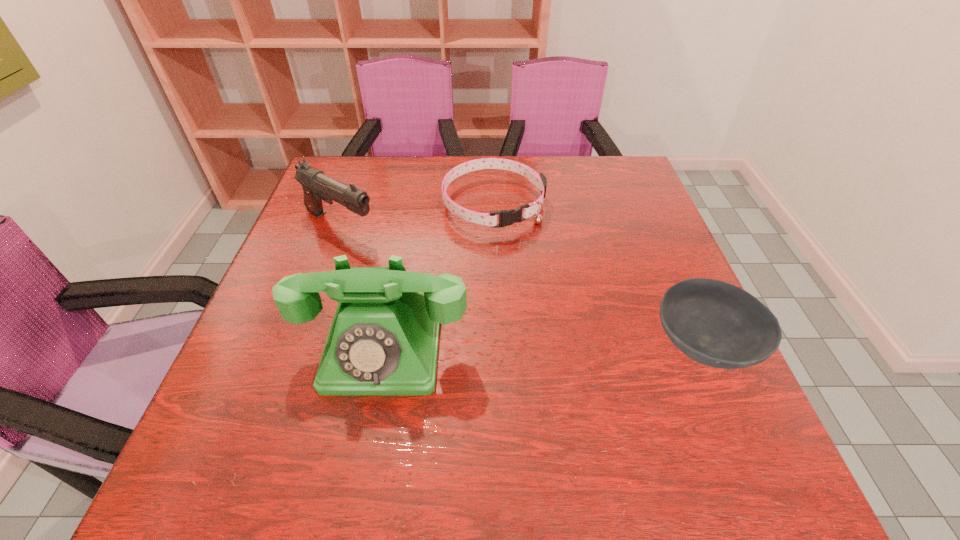
Locate an element on the screen. This screenshot has height=540, width=960. vacant space located in the direction the third shortest object is aimed is located at coordinates (474, 291).

Where is `free space located in the direction the third shortest object is aimed`? The width and height of the screenshot is (960, 540). free space located in the direction the third shortest object is aimed is located at coordinates (443, 274).

Locate an element on the screen. vacant position located in the direction the third shortest object is aimed is located at coordinates (426, 266).

Image resolution: width=960 pixels, height=540 pixels. Find the location of `object situated at the far edge`. object situated at the far edge is located at coordinates (506, 217).

This screenshot has width=960, height=540. I want to click on telephone located in the near edge section of the desktop, so (x=383, y=340).

This screenshot has width=960, height=540. Identify the location of bowl that is at the near edge. 717,324.

Identify the location of telephone positioned at the left edge. (383, 340).

Find the location of `gun that is at the left edge`. gun that is at the left edge is located at coordinates (317, 186).

The height and width of the screenshot is (540, 960). Identify the location of object present at the right edge. (717, 324).

The width and height of the screenshot is (960, 540). Identify the location of object present at the near left corner. (383, 340).